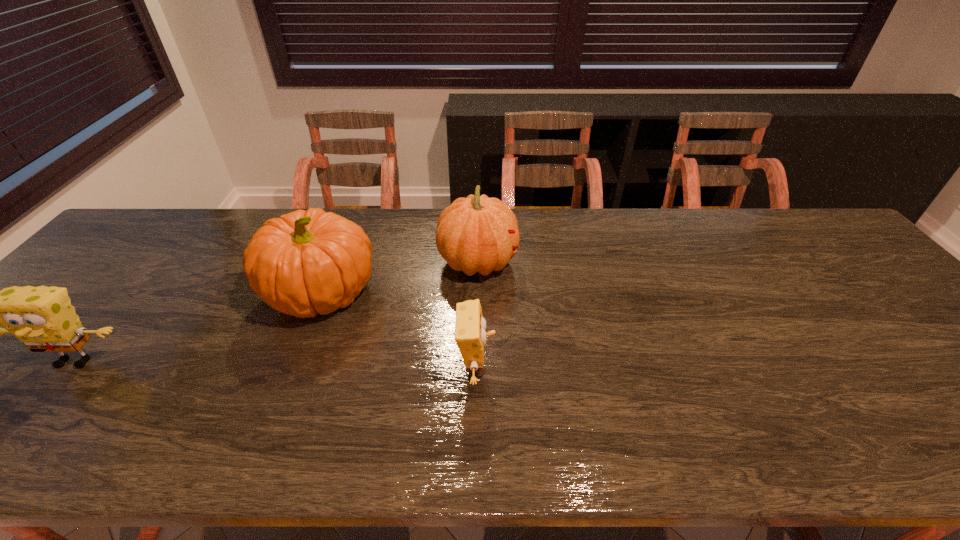
The width and height of the screenshot is (960, 540). Identify the location of empty location between the right pumpkin and the left pumpkin. (400, 278).

Locate an element on the screen. This screenshot has height=540, width=960. vacant space that is in between the second object from left to right and the taller sponge is located at coordinates (200, 327).

Where is `vacant region between the right pumpkin and the left pumpkin`? This screenshot has height=540, width=960. vacant region between the right pumpkin and the left pumpkin is located at coordinates (400, 278).

Identify the location of vacant space that's between the taller sponge and the shortest object. (276, 364).

This screenshot has height=540, width=960. I want to click on empty space between the right pumpkin and the taller sponge, so click(x=276, y=312).

Where is `free space between the second object from left to right and the right pumpkin`? free space between the second object from left to right and the right pumpkin is located at coordinates (400, 278).

Where is `vacant space that's between the third object from right to left and the right sponge`? vacant space that's between the third object from right to left and the right sponge is located at coordinates (399, 330).

Select which object is the second closest to the shorter sponge. Please provide its 2D coordinates. Your answer should be formatted as a tuple, i.e. [(x, y)], where the tuple contains the x and y coordinates of a point satisfying the conditions above.

[(307, 262)]

Point out which object is positioned as the second nearest to the right pumpkin. Please provide its 2D coordinates. Your answer should be formatted as a tuple, i.e. [(x, y)], where the tuple contains the x and y coordinates of a point satisfying the conditions above.

[(470, 335)]

Identify the location of blank space that satisfies the following two spatial constraints: 1. on the carved face of the right pumpkin; 2. on the face of the left sponge. This screenshot has width=960, height=540. (477, 361).